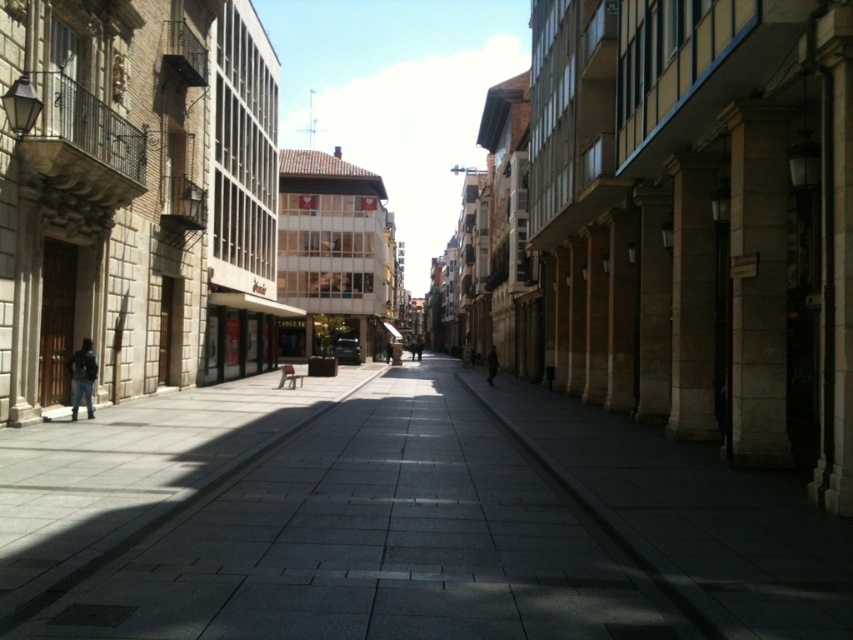
Can you confirm if dark blue jacket at left is positioned to the left of brown wool coat at center?

Correct, you'll find dark blue jacket at left to the left of brown wool coat at center.

Does point (74, 381) lie behind point (488, 381)?

No, it is in front of (488, 381).

Find the location of a particular element. The image size is (853, 640). dark blue jacket at left is located at coordinates (83, 378).

Is gray stone pavement at center thinner than dark blue jacket at left?

No.

Does gray stone pavement at center appear on the left side of dark blue jacket at left?

Incorrect, gray stone pavement at center is not on the left side of dark blue jacket at left.

This screenshot has width=853, height=640. In order to click on gray stone pavement at center in this screenshot , I will do `click(399, 520)`.

Which is more to the right, gray stone pavement at center or brown wool coat at center?

From the viewer's perspective, brown wool coat at center appears more on the right side.

Who is higher up, gray stone pavement at center or brown wool coat at center?

Positioned higher is gray stone pavement at center.

Between point (368, 609) and point (495, 369), which one is positioned in front?

Positioned in front is point (368, 609).

I want to click on gray stone pavement at center, so tap(399, 520).